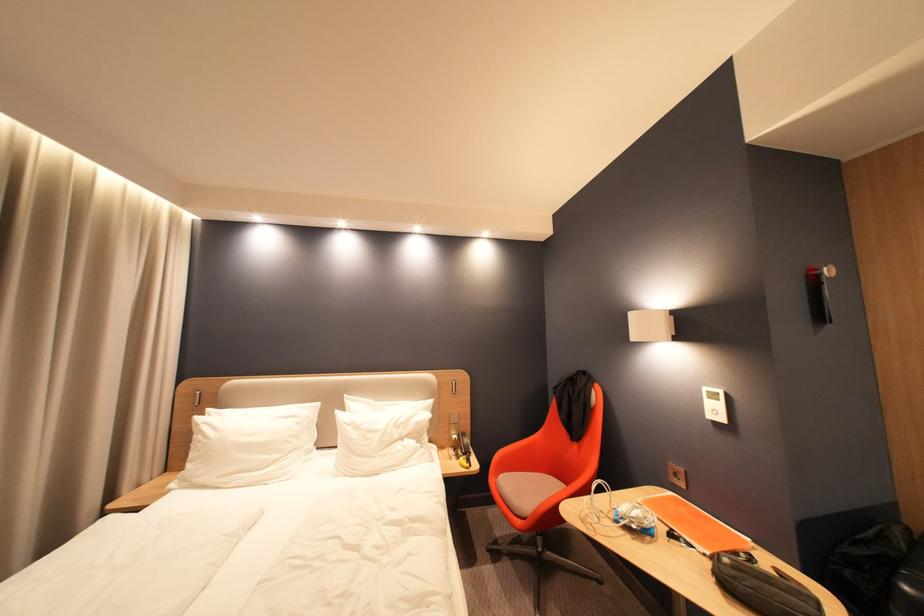
Find where to sit the chair sitting surface. Please return your answer as a coordinate pair (x, y).

(535, 485)